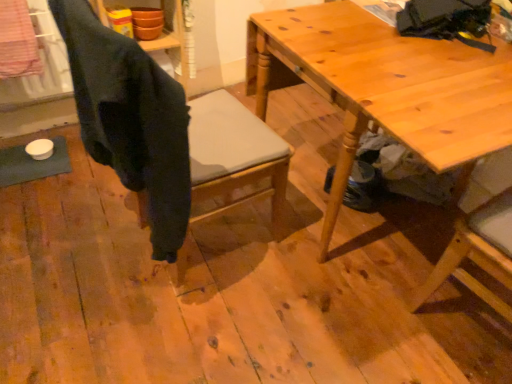
Where is `dark gray fabric chair at center`? This screenshot has width=512, height=384. dark gray fabric chair at center is located at coordinates point(131,119).

Image resolution: width=512 pixels, height=384 pixels. What do you see at coordinates (131, 119) in the screenshot?
I see `dark gray fabric chair at center` at bounding box center [131, 119].

Locate an element on the screen. wooden table at center is located at coordinates (385, 86).

Measure the distance between point (311, 69) and camera.

Point (311, 69) and camera are 4.02 feet apart.

The image size is (512, 384). What do you see at coordinates (385, 86) in the screenshot?
I see `wooden table at center` at bounding box center [385, 86].

In order to face wooden table at center, should I rotate leftwards or rightwards?

It's best to rotate right around 18.244 degrees.

Identify the location of dark gray fabric chair at center. (131, 119).

Considering the relative positions of dark gray fabric chair at center and wooden table at center in the image provided, is dark gray fabric chair at center to the right of wooden table at center from the viewer's perspective?

In fact, dark gray fabric chair at center is to the left of wooden table at center.

Relative to wooden table at center, is dark gray fabric chair at center in front or behind?

Clearly, dark gray fabric chair at center is in front of wooden table at center.

Is point (120, 85) farther from viewer compared to point (386, 47)?

No, it is not.

Looking at this image, from the image's perspective, which object appears higher, dark gray fabric chair at center or wooden table at center?

wooden table at center.

From a real-world perspective, is dark gray fabric chair at center located higher than wooden table at center?

Indeed, from a real-world perspective, dark gray fabric chair at center stands above wooden table at center.

Considering the relative sizes of dark gray fabric chair at center and wooden table at center in the image provided, is dark gray fabric chair at center thinner than wooden table at center?

Yes.

Who is taller, dark gray fabric chair at center or wooden table at center?

dark gray fabric chair at center.

Is dark gray fabric chair at center smaller than wooden table at center?

Correct, dark gray fabric chair at center occupies less space than wooden table at center.

Could wooden table at center be considered to be inside dark gray fabric chair at center?

That's incorrect, wooden table at center is not inside dark gray fabric chair at center.

Would you say dark gray fabric chair at center is a long distance from wooden table at center?

No, dark gray fabric chair at center is not far from wooden table at center.

Consider the image. Does dark gray fabric chair at center turn towards wooden table at center?

Yes, dark gray fabric chair at center is aimed at wooden table at center.

Where is `table behind the dark gray fabric chair at center`? The width and height of the screenshot is (512, 384). table behind the dark gray fabric chair at center is located at coordinates point(385,86).

Looking at this image, considering the positions of objects wooden table at center and dark gray fabric chair at center in the image provided, who is more to the right, wooden table at center or dark gray fabric chair at center?

wooden table at center is more to the right.

Which object is further away from the camera taking this photo, wooden table at center or dark gray fabric chair at center?

wooden table at center is further away from the camera.

Is point (407, 38) closer or farther from the camera than point (105, 135)?

Clearly, point (407, 38) is more distant from the camera than point (105, 135).

From the image's perspective, is wooden table at center located above or below dark gray fabric chair at center?

From the image's perspective, wooden table at center appears above dark gray fabric chair at center.

From a real-world perspective, which object rests below the other?

In real-world perspective, wooden table at center is lower.

Considering the sizes of objects wooden table at center and dark gray fabric chair at center in the image provided, who is wider, wooden table at center or dark gray fabric chair at center?

wooden table at center.

In the scene shown: Between wooden table at center and dark gray fabric chair at center, which one has more height?

dark gray fabric chair at center.

Based on the photo, which of these two, wooden table at center or dark gray fabric chair at center, is smaller?

dark gray fabric chair at center.

Which is correct: wooden table at center is inside dark gray fabric chair at center, or outside of it?

wooden table at center is located beyond the bounds of dark gray fabric chair at center.

Is wooden table at center far from dark gray fabric chair at center?

No, wooden table at center is in close proximity to dark gray fabric chair at center.

Is wooden table at center looking in the opposite direction of dark gray fabric chair at center?

No, dark gray fabric chair at center is not at the back of wooden table at center.

How many degrees apart are the facing directions of wooden table at center and dark gray fabric chair at center?

wooden table at center and dark gray fabric chair at center are facing 173 degrees away from each other.

Where is `table behind the dark gray fabric chair at center`? The width and height of the screenshot is (512, 384). table behind the dark gray fabric chair at center is located at coordinates (385, 86).

The image size is (512, 384). Find the location of `table behind the dark gray fabric chair at center`. table behind the dark gray fabric chair at center is located at coordinates (385, 86).

Image resolution: width=512 pixels, height=384 pixels. What are the coordinates of `table on the right of dark gray fabric chair at center` in the screenshot? It's located at tap(385, 86).